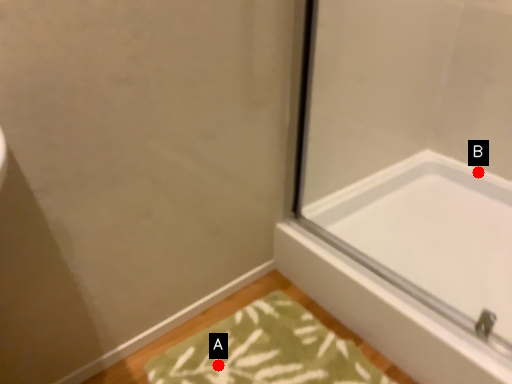
Question: Two points are circled on the image, labeled by A and B beside each circle. Which point is further to the camera?

Choices:
 (A) A is further
 (B) B is further

Answer: (B)